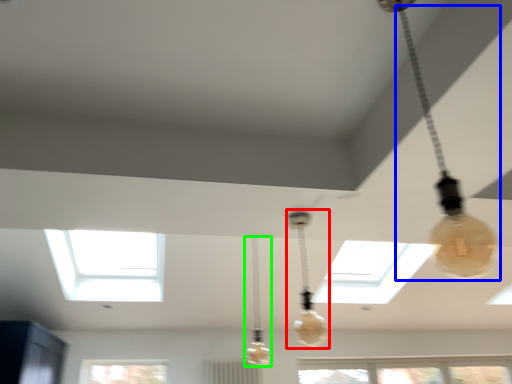
Question: Estimate the real-world distances between objects in this image. Which object is farther from lamp (highlighted by a red box), lamp (highlighted by a blue box) or lamp (highlighted by a green box)?

Choices:
 (A) lamp
 (B) lamp

Answer: (A)